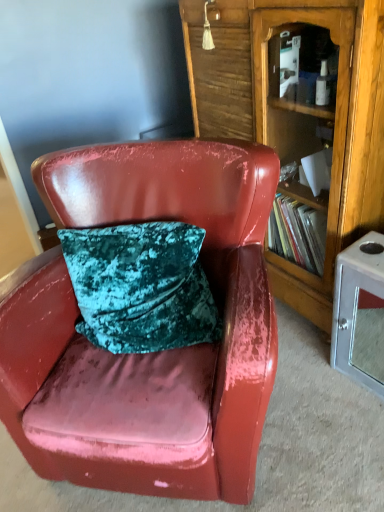
Question: Is wooden bookcase at center directly adjacent to metallic silver cabinet at lower right?

Choices:
 (A) yes
 (B) no

Answer: (B)

Question: From the image's perspective, would you say wooden bookcase at center is positioned over metallic silver cabinet at lower right?

Choices:
 (A) no
 (B) yes

Answer: (B)

Question: Is wooden bookcase at center facing away from metallic silver cabinet at lower right?

Choices:
 (A) yes
 (B) no

Answer: (B)

Question: Does wooden bookcase at center have a greater width compared to metallic silver cabinet at lower right?

Choices:
 (A) no
 (B) yes

Answer: (B)

Question: Is wooden bookcase at center to the right of metallic silver cabinet at lower right from the viewer's perspective?

Choices:
 (A) no
 (B) yes

Answer: (A)

Question: Can you confirm if wooden bookcase at center is taller than metallic silver cabinet at lower right?

Choices:
 (A) yes
 (B) no

Answer: (A)

Question: Is glossy leather chair at center positioned before metallic silver cabinet at lower right?

Choices:
 (A) no
 (B) yes

Answer: (B)

Question: Is glossy leather chair at center positioned behind metallic silver cabinet at lower right?

Choices:
 (A) yes
 (B) no

Answer: (B)

Question: From a real-world perspective, is glossy leather chair at center beneath metallic silver cabinet at lower right?

Choices:
 (A) no
 (B) yes

Answer: (A)

Question: Is glossy leather chair at center wider than metallic silver cabinet at lower right?

Choices:
 (A) no
 (B) yes

Answer: (B)

Question: Can you confirm if glossy leather chair at center is positioned to the right of metallic silver cabinet at lower right?

Choices:
 (A) no
 (B) yes

Answer: (A)

Question: Can you confirm if glossy leather chair at center is bigger than metallic silver cabinet at lower right?

Choices:
 (A) yes
 (B) no

Answer: (A)

Question: Would you say glossy leather chair at center is a long distance from wooden bookcase at center?

Choices:
 (A) no
 (B) yes

Answer: (A)